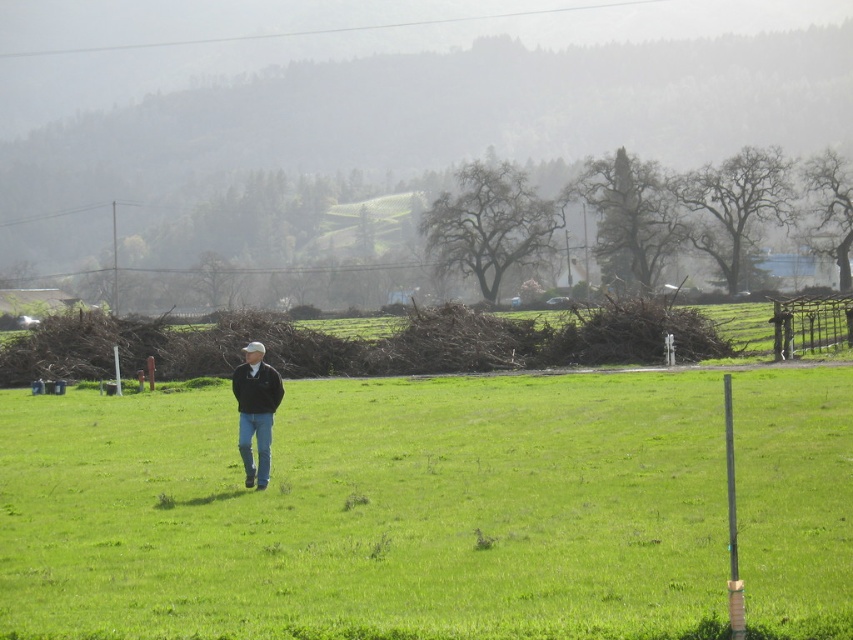
You are a photographer trying to capture the man walking across the field. Based on the scene, which object, the green grass at center or the dark blue jeans at center, will appear closer to the camera in the photo?

The green grass at center appears closer to the camera because it is in front of the dark blue jeans at center.

You are a photographer trying to capture the man walking across the field. Based on the scene, which object takes up more space in the image between the green grass at center and the dark blue jeans at center?

The green grass at center takes up more space in the image than the dark blue jeans at center because it is bigger than the dark blue jeans at center.